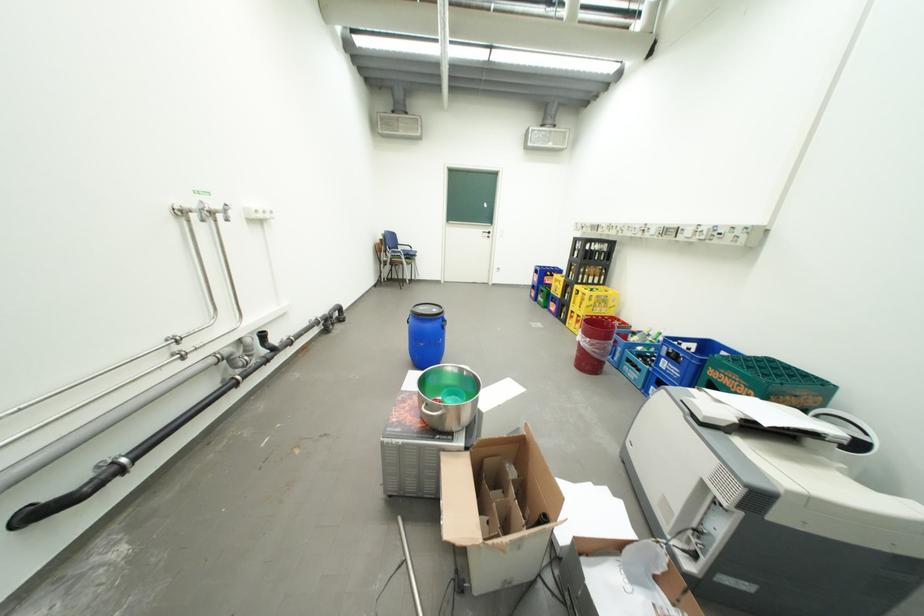
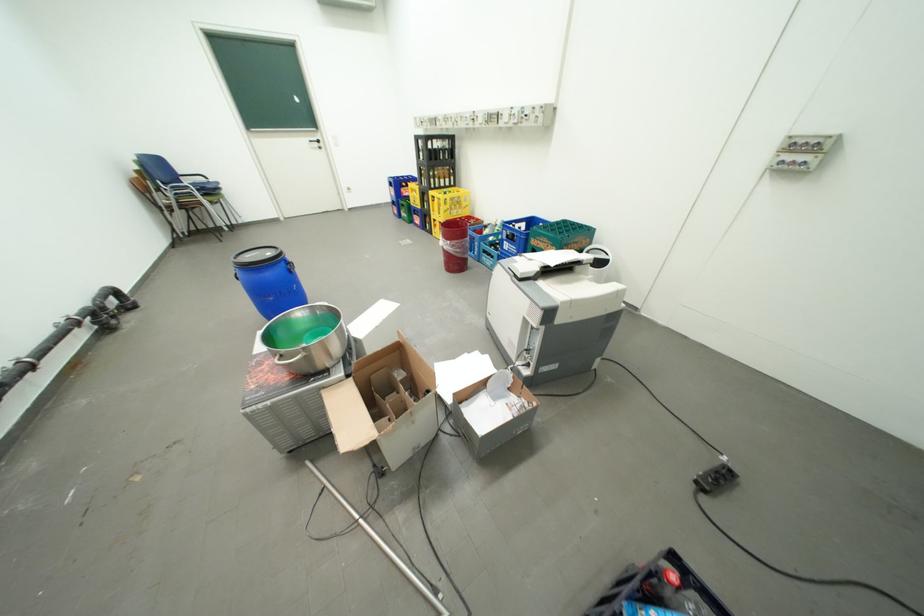
The point at (415, 565) is marked in the first image. Where is the corresponding point in the second image?

(334, 492)